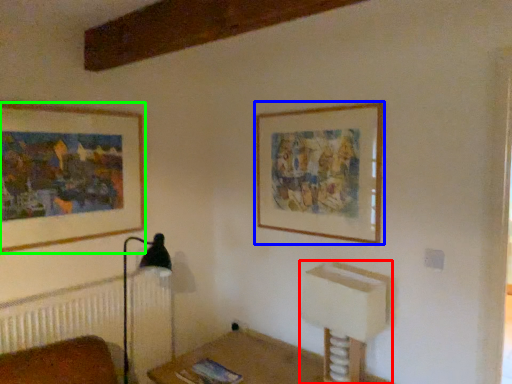
Question: Which is farther away from vanity (highlighted by a red box)? picture frame (highlighted by a blue box) or picture frame (highlighted by a green box)?

Choices:
 (A) picture frame
 (B) picture frame

Answer: (B)